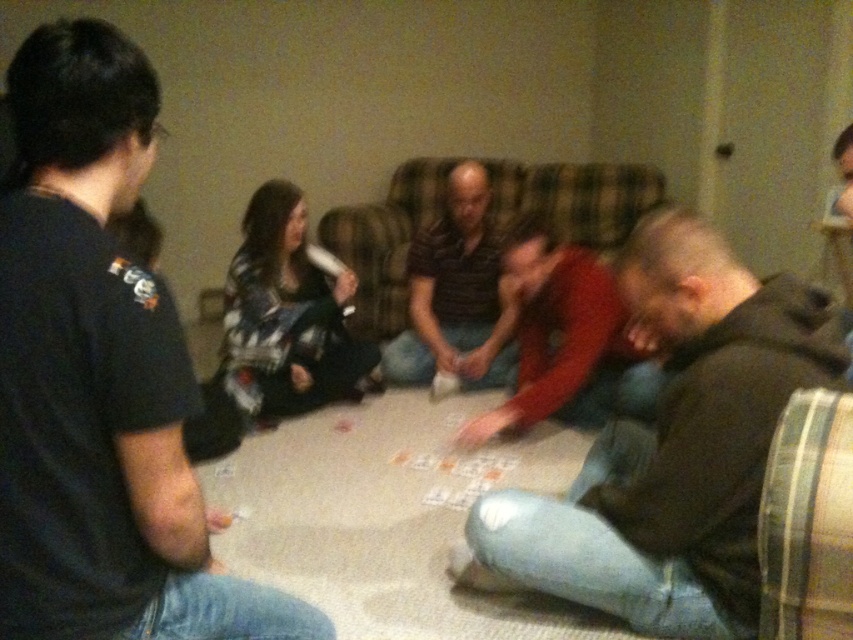
Which is in front, point (21, 45) or point (811, 381)?

Point (811, 381)

Describe the element at coordinates (100, 378) in the screenshot. I see `black t-shirt at left` at that location.

Who is more distant from viewer, (207, 524) or (700, 262)?

Positioned behind is point (207, 524).

This screenshot has width=853, height=640. What are the coordinates of `black t-shirt at left` in the screenshot? It's located at (100, 378).

Measure the distance between point (x=378, y=208) and camera.

Point (x=378, y=208) and camera are 4.15 meters apart from each other.

Which is in front, point (637, 204) or point (585, 333)?

Positioned in front is point (585, 333).

Who is more distant from viewer, (x=320, y=225) or (x=614, y=284)?

Positioned behind is point (x=320, y=225).

This screenshot has height=640, width=853. I want to click on plaid fabric couch at center, so click(x=386, y=241).

Does red sweater at center have a lesser width compared to striped cotton shirt at center?

No, red sweater at center is not thinner than striped cotton shirt at center.

Who is more distant from viewer, (x=593, y=360) or (x=467, y=209)?

The point (x=467, y=209) is behind.

Measure the distance between red sweater at center and camera.

red sweater at center and camera are 8.11 feet apart.

Image resolution: width=853 pixels, height=640 pixels. I want to click on red sweater at center, so click(x=558, y=333).